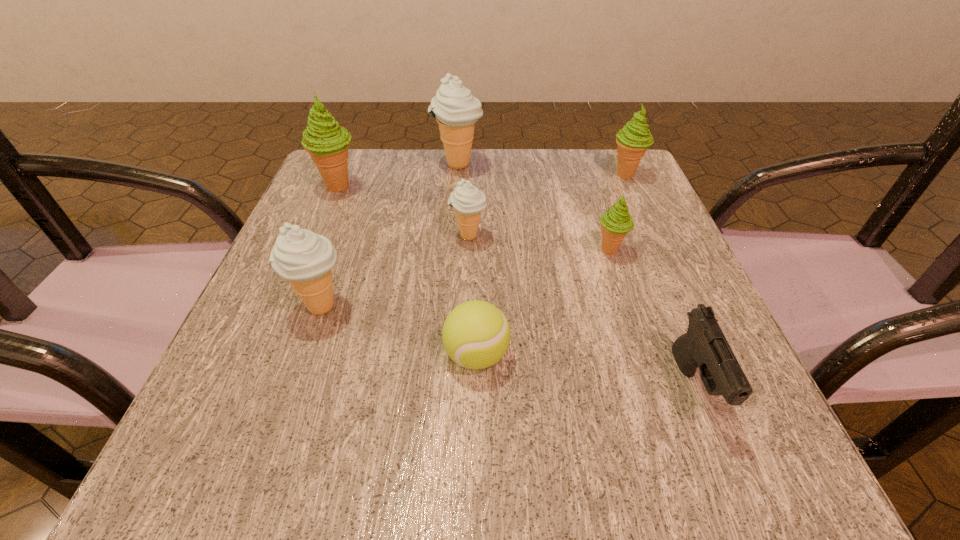
Identify the location of vacant space that is in between the green tennis ball and the second green icecream from left to right. (543, 303).

Locate an element on the screen. The height and width of the screenshot is (540, 960). vacant space that's between the rightmost icecream and the nearest icecream is located at coordinates (473, 241).

The width and height of the screenshot is (960, 540). Find the location of `vacant space in between the smallest beige icecream and the second biggest green icecream`. vacant space in between the smallest beige icecream and the second biggest green icecream is located at coordinates (547, 205).

At what (x,y) coordinates should I click in order to perform the action: click on free space between the leftmost green icecream and the rightmost icecream. Please return your answer as a coordinate pair (x, y). This screenshot has width=960, height=540. Looking at the image, I should click on (482, 180).

You are a GUI agent. You are given a task and a screenshot of the screen. Output one action in this format:
    pyautogui.click(x=<x>, y=<y>)
    Task: Click on the sixth closest object relative to the nearest beige icecream
    
    Given the screenshot: What is the action you would take?
    pyautogui.click(x=704, y=345)

Find the location of a particular element. The image size is (960, 540). object that is the fourth closest one to the nearest icecream is located at coordinates (456, 110).

Locate which icecream is the second closest to the rightmost green icecream. Please provide its 2D coordinates. Your answer should be formatted as a tuple, i.e. [(x, y)], where the tuple contains the x and y coordinates of a point satisfying the conditions above.

[(456, 110)]

The height and width of the screenshot is (540, 960). Find the location of `the closest icecream to the farthest beige icecream`. the closest icecream to the farthest beige icecream is located at coordinates (327, 143).

What are the coordinates of `beige icecream that is the closest one to the biggest beige icecream` in the screenshot? It's located at (468, 201).

Identify which beige icecream is the second closest to the biggest beige icecream. Please provide its 2D coordinates. Your answer should be formatted as a tuple, i.e. [(x, y)], where the tuple contains the x and y coordinates of a point satisfying the conditions above.

[(304, 258)]